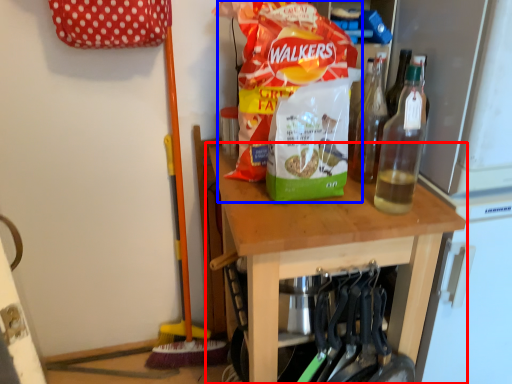
Question: Which point is further to the camera, table (highlighted by a red box) or waste (highlighted by a blue box)?

Choices:
 (A) table
 (B) waste

Answer: (B)